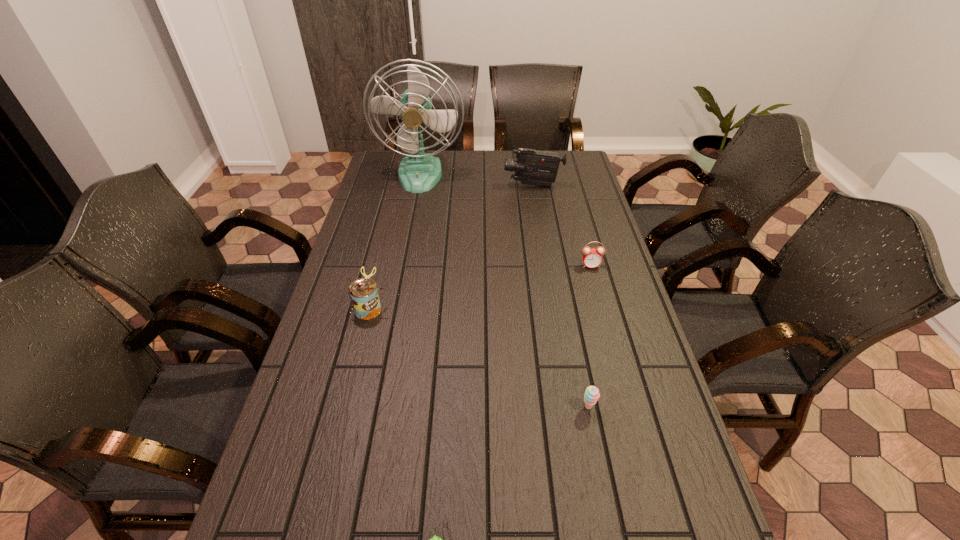
At what (x,y) coordinates should I click in order to perform the action: click on fan. Please return your answer as a coordinate pair (x, y). Looking at the image, I should click on (x=419, y=172).

Locate an element on the screen. camcorder is located at coordinates (532, 167).

Locate an element on the screen. can is located at coordinates (363, 292).

Locate an element on the screen. This screenshot has height=540, width=960. the third farthest object is located at coordinates tap(592, 258).

You are a GUI agent. You are given a task and a screenshot of the screen. Output one action in this format:
    pyautogui.click(x=<x>, y=<y>)
    Task: Click on the second nearest object
    
    Given the screenshot: What is the action you would take?
    pyautogui.click(x=591, y=395)

What are the coordinates of `vacant area situated in front of the tallest object, directing airflow` in the screenshot? It's located at (416, 201).

Locate an element on the screen. vacant space located 0.060m on the front-facing side of the camcorder is located at coordinates (489, 185).

In order to click on vacant region located 0.220m on the front-facing side of the camcorder in this screenshot , I will do `click(449, 185)`.

Where is `vacant space located on the front-facing side of the camcorder`? Image resolution: width=960 pixels, height=540 pixels. vacant space located on the front-facing side of the camcorder is located at coordinates 424,185.

The height and width of the screenshot is (540, 960). Find the location of `free space located 0.390m on the front of the can`. free space located 0.390m on the front of the can is located at coordinates (333, 458).